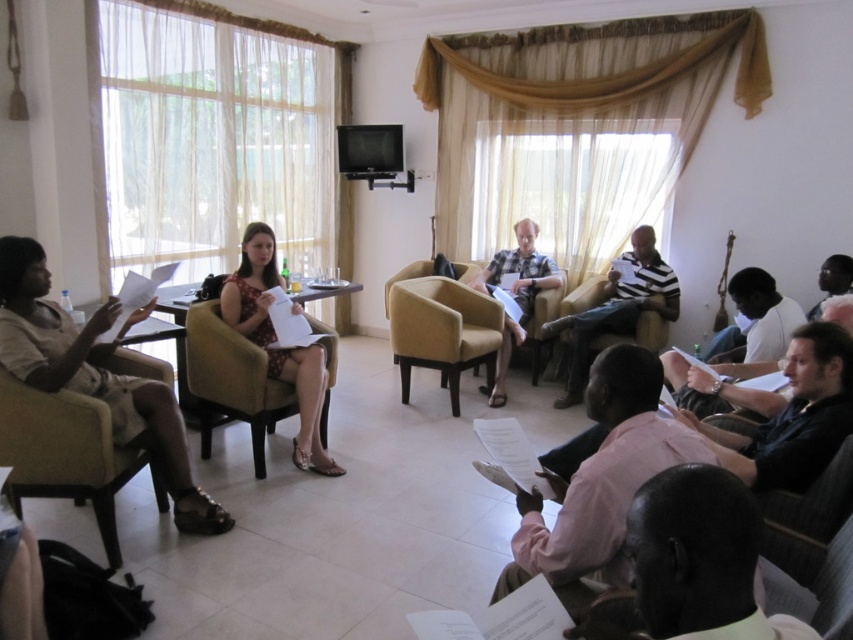
How distant is beige fabric skirt at lower left from smooth skin face at lower right?

The distance of beige fabric skirt at lower left from smooth skin face at lower right is 3.48 meters.

Who is positioned more to the left, beige fabric skirt at lower left or smooth skin face at lower right?

beige fabric skirt at lower left

Is point (80, 340) more distant than point (813, 305)?

No.

The height and width of the screenshot is (640, 853). I want to click on beige fabric skirt at lower left, so point(96,378).

Who is lower down, white paper at lower right or striped cotton shirt at center?

Positioned lower is white paper at lower right.

Who is higher up, white paper at lower right or striped cotton shirt at center?

striped cotton shirt at center is higher up.

Measure the distance between white paper at lower right and camera.

white paper at lower right is 2.75 meters from camera.

The width and height of the screenshot is (853, 640). What are the coordinates of `white paper at lower right` in the screenshot? It's located at (746, 349).

Between pink cotton shirt at lower center and plaid cotton shirt at center, which one appears on the right side from the viewer's perspective?

From the viewer's perspective, plaid cotton shirt at center appears more on the right side.

Which is behind, point (599, 520) or point (529, 289)?

Positioned behind is point (529, 289).

Find the location of a particular element. pink cotton shirt at lower center is located at coordinates (601, 477).